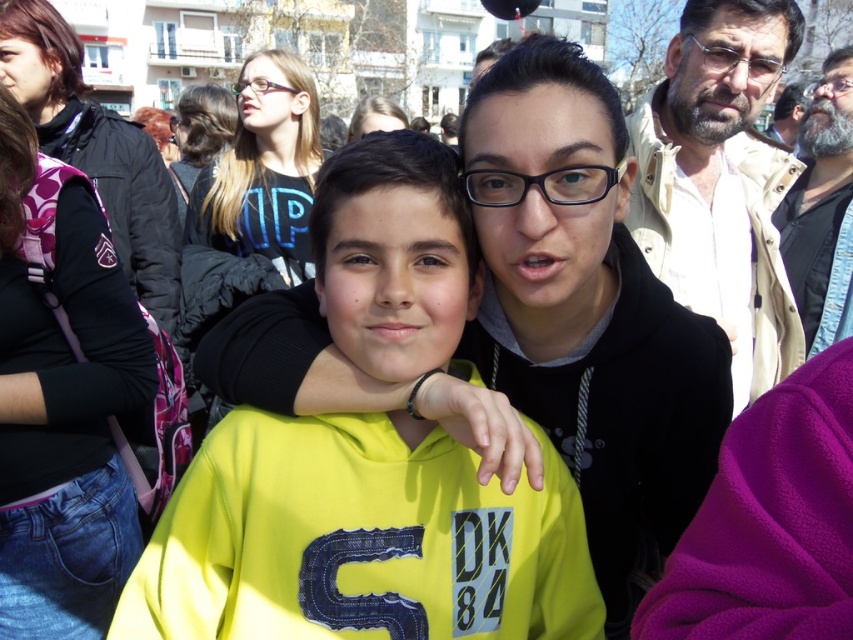
Is point (254, 108) positioned in front of point (805, 291)?

No.

In the scene shown: Can you confirm if matte black hoodie at center is positioned below bearded man at right?

Yes, matte black hoodie at center is below bearded man at right.

This screenshot has width=853, height=640. Find the location of `matte black hoodie at center`. matte black hoodie at center is located at coordinates (252, 196).

Does denim jacket at left have a lesser height compared to beige fabric jacket at upper right?

In fact, denim jacket at left may be taller than beige fabric jacket at upper right.

This screenshot has height=640, width=853. Describe the element at coordinates (62, 410) in the screenshot. I see `denim jacket at left` at that location.

At what (x,y) coordinates should I click in order to perform the action: click on denim jacket at left. Please return your answer as a coordinate pair (x, y). Looking at the image, I should click on (62, 410).

Can you confirm if beige fabric jacket at upper right is positioned to the right of matte black hair at center?

Yes, beige fabric jacket at upper right is to the right of matte black hair at center.

Does point (741, 248) come behind point (386, 116)?

No.

Is point (708, 147) positioned after point (374, 104)?

No, it is not.

I want to click on beige fabric jacket at upper right, so click(x=720, y=180).